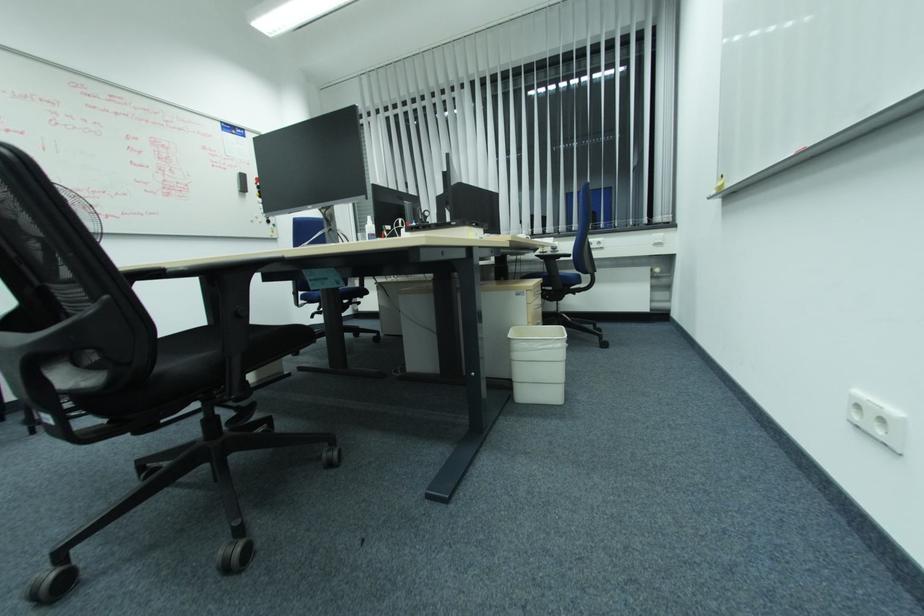
Where would you sit the black chair sitting surface? Please return your answer as a coordinate pair (x, y).

(225, 342)